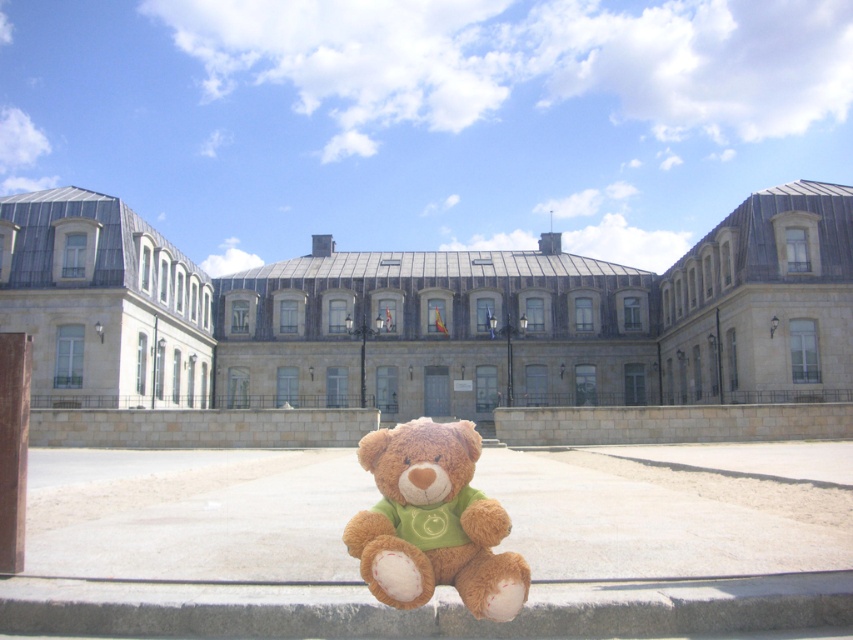
You are standing in front of the stone building at center and the soft brown teddy bear at center. Which object is closer to you?

The soft brown teddy bear at center is closer to you because the stone building at center is positioned over it, indicating the teddy bear is in the foreground.

You are standing in front of the stone building at center and the soft brown teddy bear at center. Which object is located to the right side?

The soft brown teddy bear at center is located to the right side of the stone building at center.

You are a photographer trying to capture the stone building at center and the soft brown teddy bear at center in a single shot. Given that the camera can only focus on objects within a 10 meter width, will both objects fit in the frame?

The stone building at center is wider than the soft brown teddy bear at center. Since the camera can focus on objects within a 10 meter width, both objects can fit in the frame as long as their combined width does not exceed 10 meters. However, the exact dimensions are not provided, so we cannot confirm definitively.